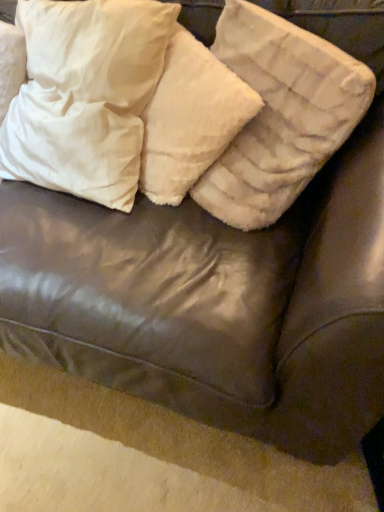
Question: Is white soft pillow at upper left, which is the 3th pillow in right-to-left order, positioned far away from white fluffy pillow at upper center, which is counted as the 3th pillow, starting from the left?

Choices:
 (A) no
 (B) yes

Answer: (A)

Question: Considering the relative sizes of white soft pillow at upper left, positioned as the 1th pillow in left-to-right order, and white fluffy pillow at upper center, which is counted as the 3th pillow, starting from the left, in the image provided, is white soft pillow at upper left, positioned as the 1th pillow in left-to-right order, smaller than white fluffy pillow at upper center, which is counted as the 3th pillow, starting from the left,?

Choices:
 (A) yes
 (B) no

Answer: (B)

Question: From the image's perspective, is white soft pillow at upper left, positioned as the 1th pillow in left-to-right order, under white fluffy pillow at upper center, which is counted as the 3th pillow, starting from the left?

Choices:
 (A) yes
 (B) no

Answer: (B)

Question: Does white soft pillow at upper left, which is the 3th pillow in right-to-left order, turn towards white fluffy pillow at upper center, marked as the 1th pillow in a right-to-left arrangement?

Choices:
 (A) no
 (B) yes

Answer: (A)

Question: Does white soft pillow at upper left, positioned as the 1th pillow in left-to-right order, appear on the left side of white fluffy pillow at upper center, which is counted as the 3th pillow, starting from the left?

Choices:
 (A) yes
 (B) no

Answer: (A)

Question: Does white soft pillow at upper left, positioned as the 1th pillow in left-to-right order, have a greater height compared to white fluffy pillow at upper center, marked as the 1th pillow in a right-to-left arrangement?

Choices:
 (A) no
 (B) yes

Answer: (B)

Question: Can you confirm if white soft pillow at upper left, positioned as the 1th pillow in left-to-right order, is smaller than white fluffy pillow at upper center, arranged as the 2th pillow when viewed from the left?

Choices:
 (A) yes
 (B) no

Answer: (B)

Question: Is the position of white soft pillow at upper left, which is the 3th pillow in right-to-left order, more distant than that of white fluffy pillow at upper center, arranged as the 2th pillow when viewed from the left?

Choices:
 (A) no
 (B) yes

Answer: (A)

Question: Does white soft pillow at upper left, which is the 3th pillow in right-to-left order, appear on the left side of white fluffy pillow at upper center, arranged as the 2th pillow when viewed from the left?

Choices:
 (A) yes
 (B) no

Answer: (A)

Question: Can you confirm if white soft pillow at upper left, which is the 3th pillow in right-to-left order, is taller than white fluffy pillow at upper center, arranged as the 2th pillow when viewed from the left?

Choices:
 (A) no
 (B) yes

Answer: (B)

Question: From a real-world perspective, is white soft pillow at upper left, which is the 3th pillow in right-to-left order, on white fluffy pillow at upper center, the 2th pillow positioned from the right?

Choices:
 (A) yes
 (B) no

Answer: (A)

Question: From a real-world perspective, is white soft pillow at upper left, which is the 3th pillow in right-to-left order, positioned under white fluffy pillow at upper center, the 2th pillow positioned from the right, based on gravity?

Choices:
 (A) yes
 (B) no

Answer: (B)

Question: Is white fluffy pillow at upper center, marked as the 1th pillow in a right-to-left arrangement, shorter than white soft pillow at upper left, positioned as the 1th pillow in left-to-right order?

Choices:
 (A) yes
 (B) no

Answer: (A)